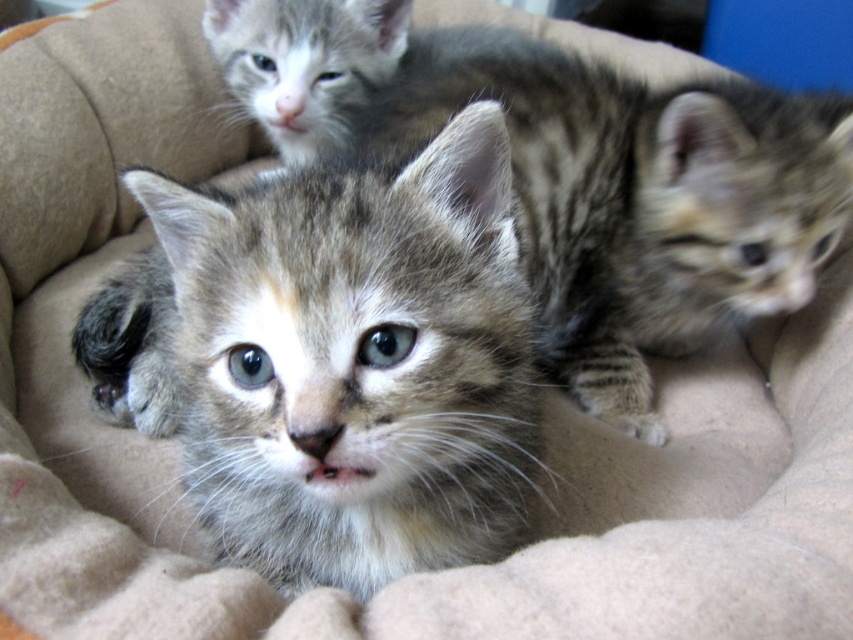
Does gray tabby kitten at center have a lesser width compared to tabby fur kitten at center?

Correct, gray tabby kitten at center's width is less than tabby fur kitten at center's.

Does gray tabby kitten at center appear on the left side of tabby fur kitten at center?

Indeed, gray tabby kitten at center is positioned on the left side of tabby fur kitten at center.

The image size is (853, 640). Identify the location of gray tabby kitten at center. (355, 362).

Find the location of a particular element. This screenshot has width=853, height=640. gray tabby kitten at center is located at coordinates (355, 362).